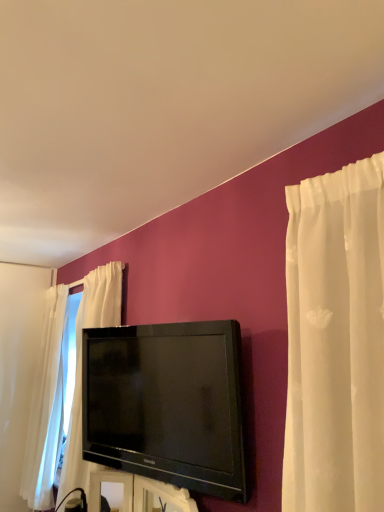
The width and height of the screenshot is (384, 512). Describe the element at coordinates (166, 404) in the screenshot. I see `black glossy tv at center` at that location.

What is the approximate height of black glossy tv at center?

It is 19.66 inches.

What is the approximate width of black glossy tv at center?

3.63 inches.

Where is `black glossy tv at center`? This screenshot has width=384, height=512. black glossy tv at center is located at coordinates (166, 404).

This screenshot has width=384, height=512. Describe the element at coordinates (138, 492) in the screenshot. I see `black glossy tv at center` at that location.

This screenshot has width=384, height=512. I want to click on black glossy tv at center, so click(x=138, y=492).

The image size is (384, 512). I want to click on black glossy tv at center, so click(166, 404).

Based on the photo, in the image, is black glossy tv at center on the left side or the right side of black glossy tv at center?

Clearly, black glossy tv at center is on the left of black glossy tv at center in the image.

Between black glossy tv at center and black glossy tv at center, which one is positioned in front?

black glossy tv at center.

Which is closer, (213, 364) or (127, 498)?

Clearly, point (213, 364) is closer to the camera than point (127, 498).

From the image's perspective, which is below, black glossy tv at center or black glossy tv at center?

From the image's view, black glossy tv at center is below.

From a real-world perspective, between black glossy tv at center and black glossy tv at center, who is vertically lower?

black glossy tv at center.

Consider the image. Considering the sizes of black glossy tv at center and black glossy tv at center in the image, is black glossy tv at center wider or thinner than black glossy tv at center?

Considering their sizes, black glossy tv at center looks slimmer than black glossy tv at center.

Is black glossy tv at center taller than black glossy tv at center?

Indeed, black glossy tv at center has a greater height compared to black glossy tv at center.

Is black glossy tv at center smaller than black glossy tv at center?

No, black glossy tv at center is not smaller than black glossy tv at center.

Does black glossy tv at center contain black glossy tv at center?

That's incorrect, black glossy tv at center is not inside black glossy tv at center.

Are black glossy tv at center and black glossy tv at center beside each other?

black glossy tv at center is not next to black glossy tv at center, and they're not touching.

Is black glossy tv at center turned away from black glossy tv at center?

No, black glossy tv at center is not facing away from black glossy tv at center.

How different are the orientations of black glossy tv at center and black glossy tv at center in degrees?

The angular difference between black glossy tv at center and black glossy tv at center is 10.9 degrees.

This screenshot has width=384, height=512. In order to click on furniture lying in front of the black glossy tv at center in this screenshot , I will do `click(138, 492)`.

Which is more to the left, black glossy tv at center or black glossy tv at center?

From the viewer's perspective, black glossy tv at center appears more on the left side.

Is the position of black glossy tv at center more distant than that of black glossy tv at center?

A: No.

Which is in front, point (97, 508) or point (237, 419)?

The point (237, 419) is more forward.

Based on the photo, from the image's perspective, is black glossy tv at center on top of black glossy tv at center?

Actually, black glossy tv at center appears below black glossy tv at center in the image.

From a real-world perspective, is black glossy tv at center physically below black glossy tv at center?

Yes, from a real-world perspective, black glossy tv at center is beneath black glossy tv at center.

Looking at their sizes, would you say black glossy tv at center is wider or thinner than black glossy tv at center?

Clearly, black glossy tv at center has more width compared to black glossy tv at center.

Can you confirm if black glossy tv at center is taller than black glossy tv at center?

No, black glossy tv at center is not taller than black glossy tv at center.

Can you confirm if black glossy tv at center is bigger than black glossy tv at center?

Actually, black glossy tv at center might be smaller than black glossy tv at center.

Is black glossy tv at center completely or partially inside black glossy tv at center?

No.

Are black glossy tv at center and black glossy tv at center beside each other?

black glossy tv at center and black glossy tv at center are clearly separated.

Is black glossy tv at center facing away from black glossy tv at center?

No.

Can you tell me how much black glossy tv at center and black glossy tv at center differ in facing direction?

10.9 degrees separate the facing orientations of black glossy tv at center and black glossy tv at center.

The height and width of the screenshot is (512, 384). I want to click on furniture below the black glossy tv at center (from the image's perspective), so click(x=138, y=492).

You are a GUI agent. You are given a task and a screenshot of the screen. Output one action in this format:
    pyautogui.click(x=<x>, y=<y>)
    Task: Click on the furniture on the right of black glossy tv at center
    
    Given the screenshot: What is the action you would take?
    pyautogui.click(x=138, y=492)

Where is `furniture beneath the black glossy tv at center (from a real-world perspective)`? furniture beneath the black glossy tv at center (from a real-world perspective) is located at coordinates (138, 492).